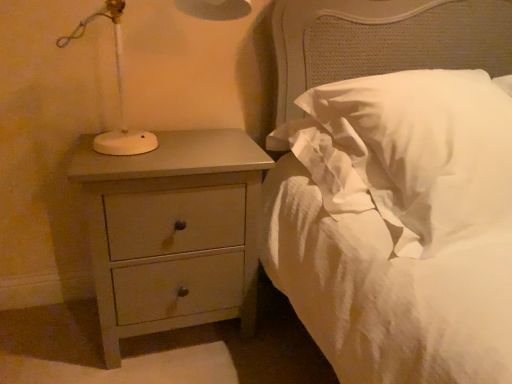
Image resolution: width=512 pixels, height=384 pixels. Identify the location of free space above matte gray chest of drawers at left (from a real-world perspective). (178, 149).